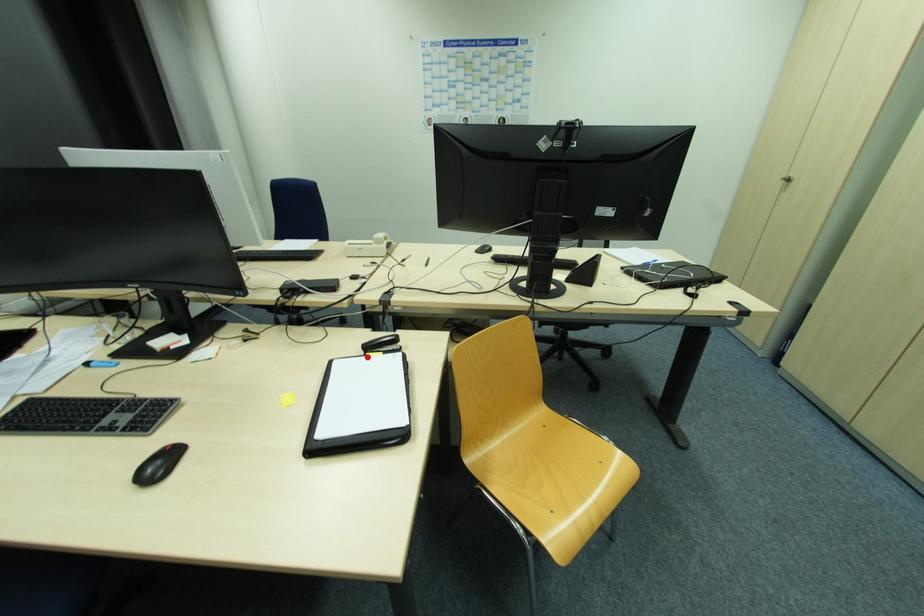
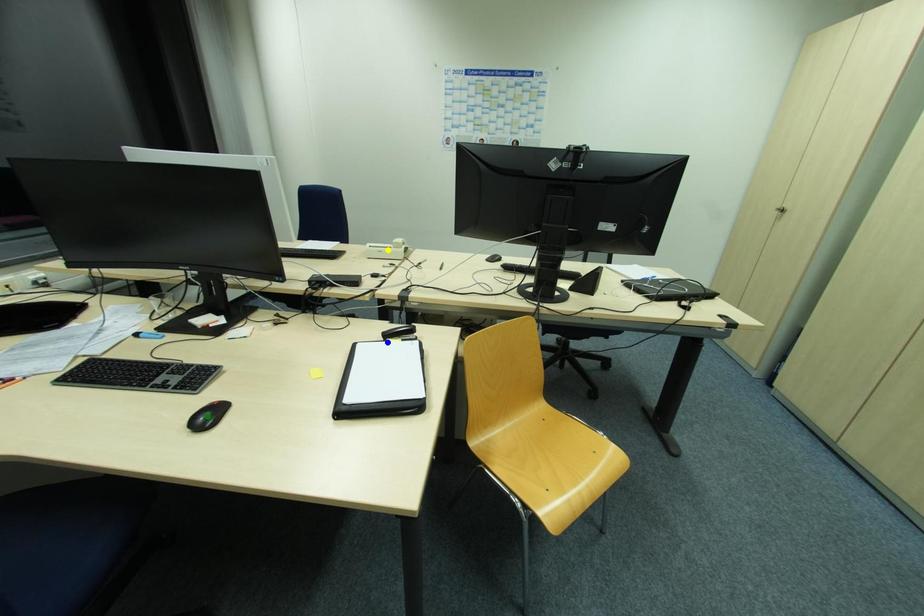
Question: I am providing you with two images of the same scene from different viewpoints. A red point is marked on the first image. You are given multiple points on the second image. Can you choose the point in image 2 that corresponds to the point in image 1?

Choices:
 (A) yellow point
 (B) blue point
 (C) green point

Answer: (B)